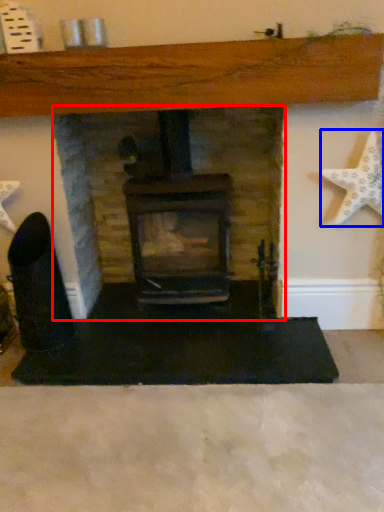
Question: Which object appears closest to the camera in this image, fireplace (highlighted by a red box) or starfish (highlighted by a blue box)?

Choices:
 (A) fireplace
 (B) starfish

Answer: (B)